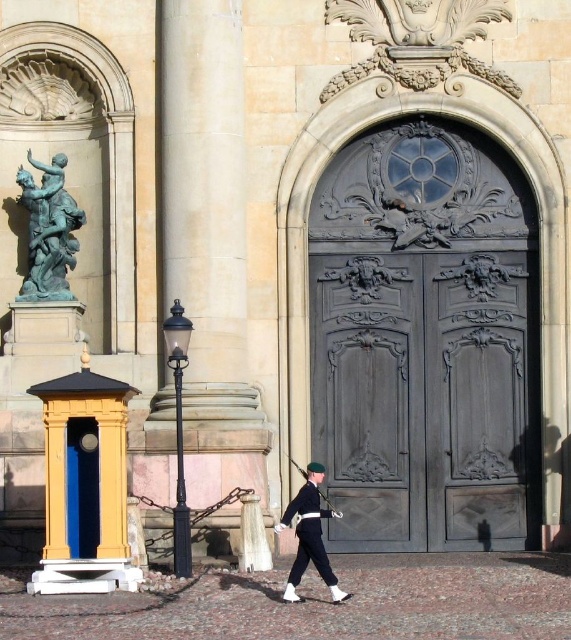
You are an architect designing a new historical building and want to place a dark gray wood door at center and a polished wood rifle at center in the midground. Based on the scene description, which object should be placed higher to maintain the original proportions?

The dark gray wood door at center should be placed higher since it is much taller than the polished wood rifle at center according to the scene description.